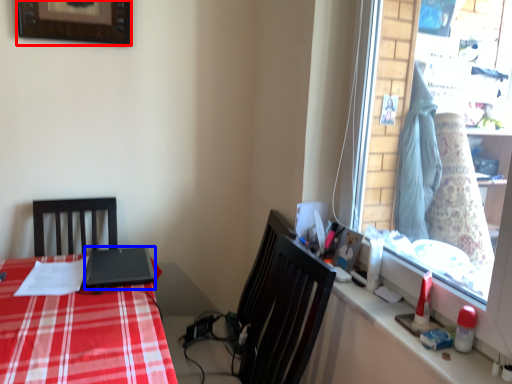
Question: Among these objects, which one is farthest to the camera, picture frame (highlighted by a red box) or laptop (highlighted by a blue box)?

Choices:
 (A) picture frame
 (B) laptop

Answer: (A)